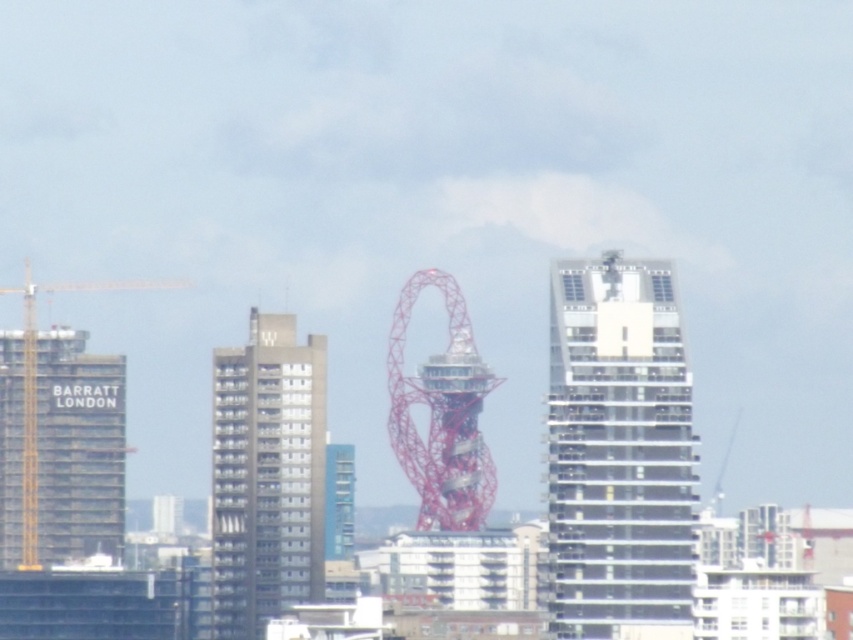
Question: Is metallic red sculpture at center bigger than yellow metallic crane at left?

Choices:
 (A) no
 (B) yes

Answer: (A)

Question: Among these objects, which one is nearest to the camera?

Choices:
 (A) gray concrete building at center
 (B) metallic red sculpture at center
 (C) white glass building at center
 (D) yellow metallic crane at left

Answer: (B)

Question: From the image, what is the correct spatial relationship of white glass building at center in relation to metallic red sculpture at center?

Choices:
 (A) right
 (B) left

Answer: (A)

Question: Among these points, which one is farthest from the camera?

Choices:
 (A) (392, 426)
 (B) (30, 497)

Answer: (B)

Question: Which is farther from the metallic red sculpture at center?

Choices:
 (A) gray concrete building at center
 (B) yellow metallic crane at left
 (C) white glass building at center

Answer: (B)

Question: Is gray concrete building at center behind metallic red sculpture at center?

Choices:
 (A) no
 (B) yes

Answer: (B)